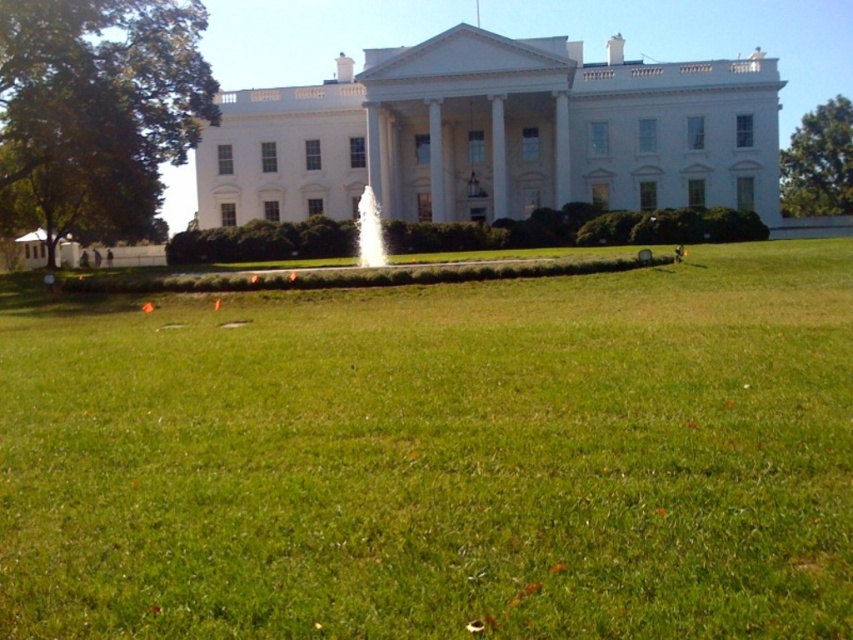
Question: Is green grass at center thinner than white stone fountain at center?

Choices:
 (A) yes
 (B) no

Answer: (B)

Question: Considering the relative positions of green grass at center and white stone fountain at center in the image provided, where is green grass at center located with respect to white stone fountain at center?

Choices:
 (A) left
 (B) right

Answer: (B)

Question: Which object appears closest to the camera in this image?

Choices:
 (A) green grass at center
 (B) white stone fountain at center

Answer: (A)

Question: Is green grass at center thinner than white stone fountain at center?

Choices:
 (A) yes
 (B) no

Answer: (B)